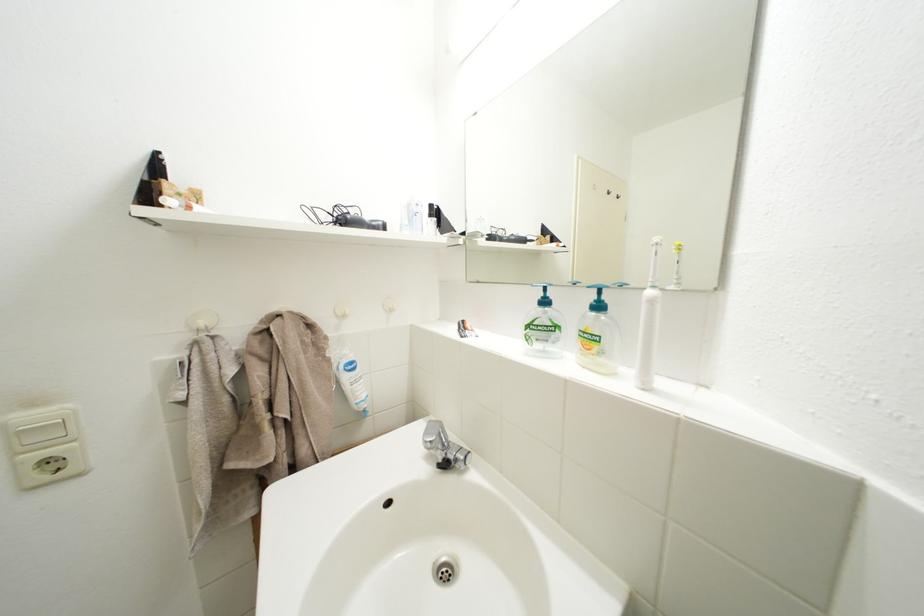
Where is `white electric toothbrush`? This screenshot has width=924, height=616. white electric toothbrush is located at coordinates (649, 323).